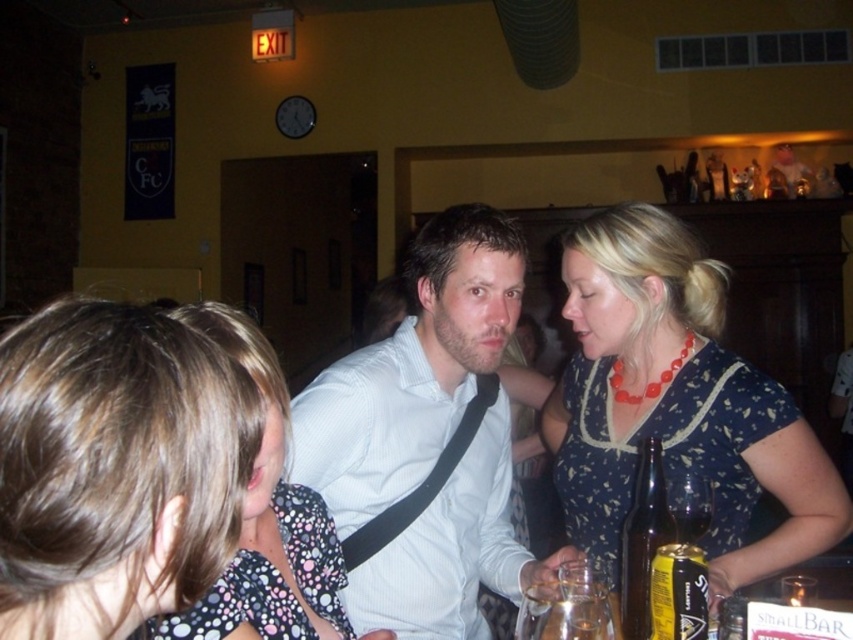
Question: Which object appears closest to the camera in this image?

Choices:
 (A) translucent glass at lower right
 (B) brown glass bottle at lower right
 (C) yellow matte can at center

Answer: (C)

Question: Does polka dot fabric dress at center have a larger size compared to clear glass bottle at lower center?

Choices:
 (A) yes
 (B) no

Answer: (B)

Question: Considering the real-world distances, which object is closest to the brown glass bottle at lower right?

Choices:
 (A) blue dotted dress at center
 (B) clear glass bottle at lower center
 (C) yellow matte can at center
 (D) polka dot fabric dress at center

Answer: (C)

Question: Does polka dot blouse at center appear under translucent glass at lower right?

Choices:
 (A) yes
 (B) no

Answer: (B)

Question: Can you confirm if white textured shirt at center is positioned below translucent glass at lower right?

Choices:
 (A) yes
 (B) no

Answer: (B)

Question: Which of these objects is positioned farthest from the clear glass bottle at lower center?

Choices:
 (A) polka dot blouse at center
 (B) translucent glass at lower right
 (C) white textured shirt at center

Answer: (A)